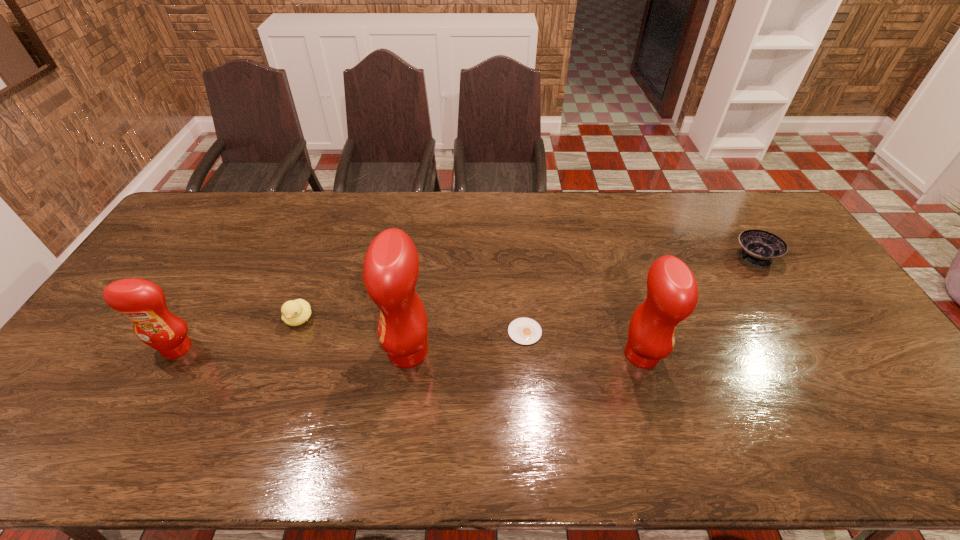
Given the evenly spaced condiments in the image, where should an extra condiment be added on the right to preserve the spacing? Please point to a vacant space. Please provide its 2D coordinates. Your answer should be formatted as a tuple, i.e. [(x, y)], where the tuple contains the x and y coordinates of a point satisfying the conditions above.

[(878, 358)]